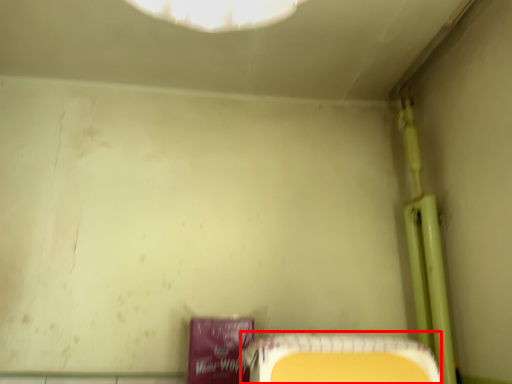
Question: From the image's perspective, where is furniture (annotated by the red box) located relative to pipe?

Choices:
 (A) above
 (B) below

Answer: (B)